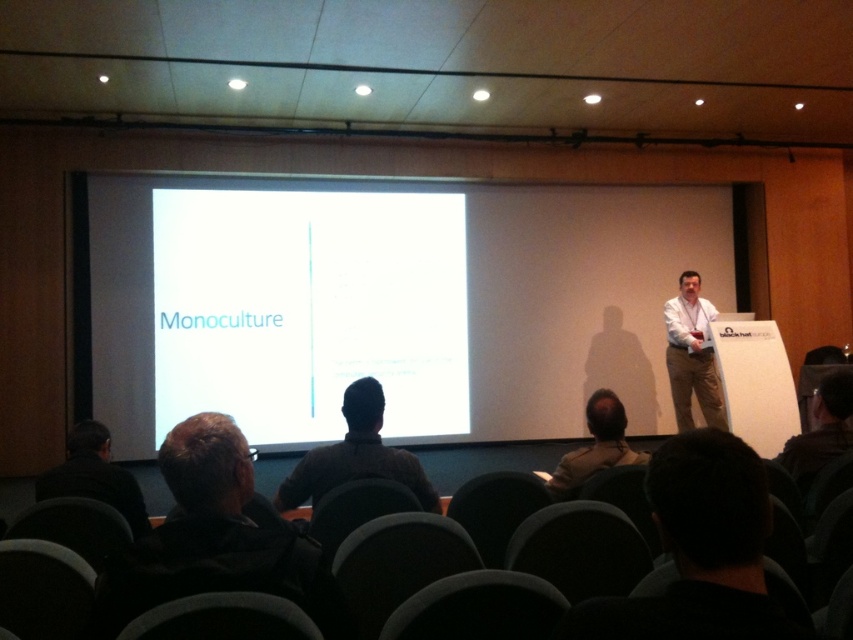
You are an attendee sitting in the front row of the conference room. You notice two items on the stage, the khaki cotton pants at right and the dark gray shirt at lower left. Which item is closer to you?

The khaki cotton pants at right is closer to you because it is further to the viewer than the dark gray shirt at lower left.

In the presentation scene, you notice two items in the audience area. The first is a dark brown sweater at center and the second is a dark gray shirt at lower left. Which of these two items is positioned more to the right side of the scene?

The dark brown sweater at center is positioned to the right of the dark gray shirt at lower left, so the dark brown sweater at center is more to the right side of the scene.